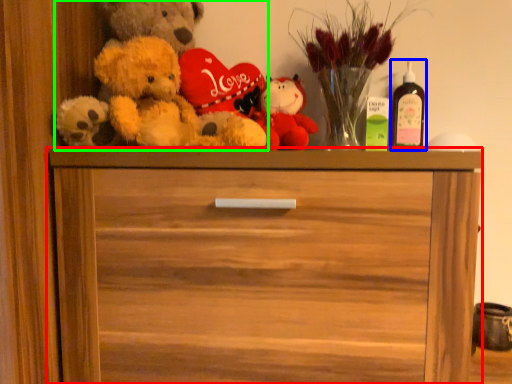
Question: Estimate the real-world distances between objects in this image. Which object is farther from chest of drawers (highlighted by a red box), wine bottle (highlighted by a blue box) or teddy bear (highlighted by a green box)?

Choices:
 (A) wine bottle
 (B) teddy bear

Answer: (A)